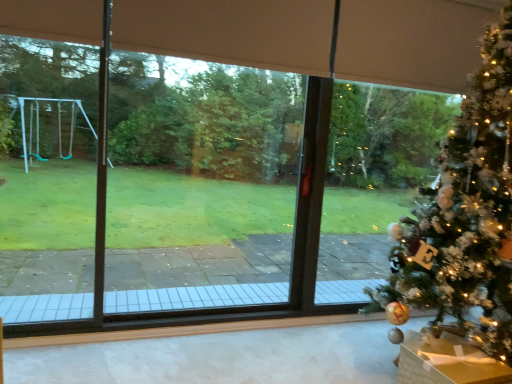
Identify the location of metallic gold ornament at lower right. The height and width of the screenshot is (384, 512). (446, 362).

The width and height of the screenshot is (512, 384). Describe the element at coordinates (446, 362) in the screenshot. I see `metallic gold ornament at lower right` at that location.

This screenshot has height=384, width=512. What do you see at coordinates (466, 215) in the screenshot?
I see `white fluffy christmas tree at right` at bounding box center [466, 215].

You are a GUI agent. You are given a task and a screenshot of the screen. Output one action in this format:
    pyautogui.click(x=<x>, y=<y>)
    Task: Click on the white fluffy christmas tree at right
    
    Given the screenshot: What is the action you would take?
    pyautogui.click(x=466, y=215)

Identify the location of metallic gold ornament at lower right. (446, 362).

Can you confirm if metallic gold ornament at lower right is positioned to the left of white fluffy christmas tree at right?

Yes.

Is metallic gold ornament at lower right closer to the viewer compared to white fluffy christmas tree at right?

That is False.

Is point (493, 370) in front of point (432, 304)?

That is True.

From the picture: From the image's perspective, which one is positioned higher, metallic gold ornament at lower right or white fluffy christmas tree at right?

white fluffy christmas tree at right appears higher in the image.

From a real-world perspective, is metallic gold ornament at lower right below white fluffy christmas tree at right?

Indeed, from a real-world perspective, metallic gold ornament at lower right is positioned beneath white fluffy christmas tree at right.

Considering the sizes of objects metallic gold ornament at lower right and white fluffy christmas tree at right in the image provided, who is thinner, metallic gold ornament at lower right or white fluffy christmas tree at right?

With smaller width is metallic gold ornament at lower right.

Based on the photo, who is taller, metallic gold ornament at lower right or white fluffy christmas tree at right?

white fluffy christmas tree at right.

Looking at the image, does metallic gold ornament at lower right seem bigger or smaller compared to white fluffy christmas tree at right?

Clearly, metallic gold ornament at lower right is smaller in size than white fluffy christmas tree at right.

Is metallic gold ornament at lower right completely or partially outside of white fluffy christmas tree at right?

No, metallic gold ornament at lower right is not entirely external to white fluffy christmas tree at right.

Would you consider metallic gold ornament at lower right to be distant from white fluffy christmas tree at right?

Actually, metallic gold ornament at lower right and white fluffy christmas tree at right are a little close together.

Is metallic gold ornament at lower right looking in the opposite direction of white fluffy christmas tree at right?

Yes, metallic gold ornament at lower right's orientation is away from white fluffy christmas tree at right.

You are a GUI agent. You are given a task and a screenshot of the screen. Output one action in this format:
    pyautogui.click(x=<x>, y=<y>)
    Task: Click on the furniture located underneath the white fluffy christmas tree at right (from a real-world perspective)
    
    Given the screenshot: What is the action you would take?
    [x=446, y=362]

Based on the photo, considering the relative positions of white fluffy christmas tree at right and metallic gold ornament at lower right in the image provided, is white fluffy christmas tree at right to the left or to the right of metallic gold ornament at lower right?

white fluffy christmas tree at right is positioned on metallic gold ornament at lower right's right side.

Does white fluffy christmas tree at right lie in front of metallic gold ornament at lower right?

Yes, it is.

Does point (435, 261) appear closer or farther from the camera than point (501, 379)?

Point (435, 261).

In the scene shown: From the image's perspective, relative to metallic gold ornament at lower right, is white fluffy christmas tree at right above or below?

From the image's perspective, white fluffy christmas tree at right appears above metallic gold ornament at lower right.

From a real-world perspective, which is physically below, white fluffy christmas tree at right or metallic gold ornament at lower right?

In real-world perspective, metallic gold ornament at lower right is lower.

Between white fluffy christmas tree at right and metallic gold ornament at lower right, which one has smaller width?

With smaller width is metallic gold ornament at lower right.

In terms of height, does white fluffy christmas tree at right look taller or shorter compared to metallic gold ornament at lower right?

Clearly, white fluffy christmas tree at right is taller compared to metallic gold ornament at lower right.

Considering the relative sizes of white fluffy christmas tree at right and metallic gold ornament at lower right in the image provided, is white fluffy christmas tree at right smaller than metallic gold ornament at lower right?

No.

Is metallic gold ornament at lower right located within white fluffy christmas tree at right?

That's correct, metallic gold ornament at lower right is inside white fluffy christmas tree at right.

Is white fluffy christmas tree at right positioned far away from metallic gold ornament at lower right?

No.

Is white fluffy christmas tree at right looking in the opposite direction of metallic gold ornament at lower right?

No, white fluffy christmas tree at right's orientation is not away from metallic gold ornament at lower right.

How different are the orientations of white fluffy christmas tree at right and metallic gold ornament at lower right in degrees?

The angular difference between white fluffy christmas tree at right and metallic gold ornament at lower right is 4.77 degrees.

Find the location of a particular element. This screenshot has height=384, width=512. christmas tree lying above the metallic gold ornament at lower right (from the image's perspective) is located at coordinates (466, 215).

Where is `furniture on the left of white fluffy christmas tree at right`? The image size is (512, 384). furniture on the left of white fluffy christmas tree at right is located at coordinates (446, 362).

The height and width of the screenshot is (384, 512). What are the coordinates of `furniture below the white fluffy christmas tree at right (from the image's perspective)` in the screenshot? It's located at (446, 362).